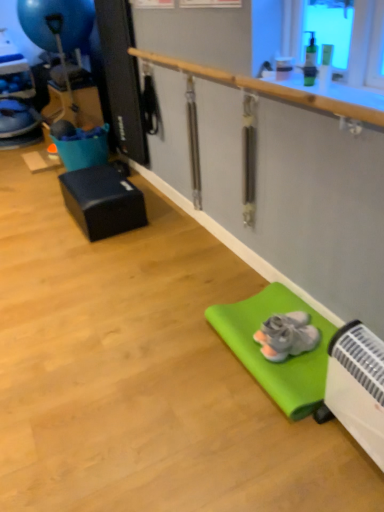
Where is `free space above green rubber yoga mat at lower right (from a real-world perspective)`? This screenshot has height=512, width=384. free space above green rubber yoga mat at lower right (from a real-world perspective) is located at coordinates (298, 327).